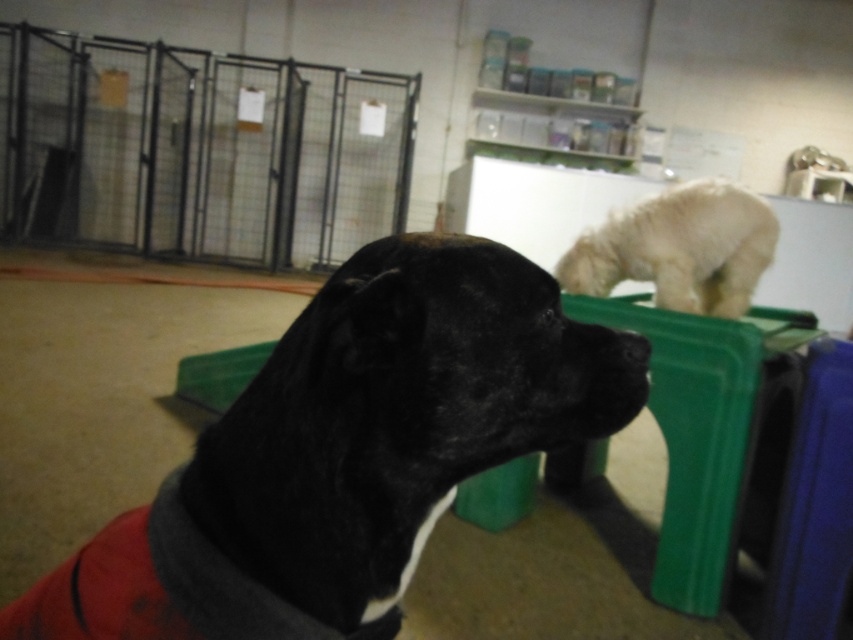
Consider the image. You are standing at the entrance of the kennel and see the black fur dog at center. If you want to approach the dog, which direction should you move relative to your current position?

Since the black fur dog at center is located at coordinates approximately 0.708 on the x axis and 0.409 on the y axis, you should move towards the right and slightly forward from your current position at the entrance to reach the dog.

You are a volunteer at the animal shelter and need to place a new blanket in the kennel. The blanket is designed to fit dogs up to the width of the white fluffy dog at upper center. Can the blanket accommodate the black fur dog at center?

The black fur dog at center might be wider than white fluffy dog at upper center, so the blanket designed for the white fluffy dog at upper center may not be sufficient to accommodate the black fur dog at center.